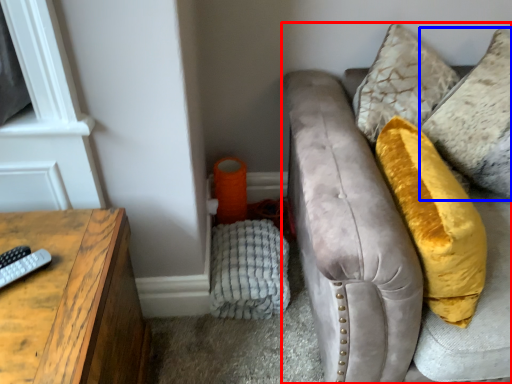
Question: Which of the following is the closest to the observer, studio couch (highlighted by a red box) or pillow (highlighted by a blue box)?

Choices:
 (A) studio couch
 (B) pillow

Answer: (A)